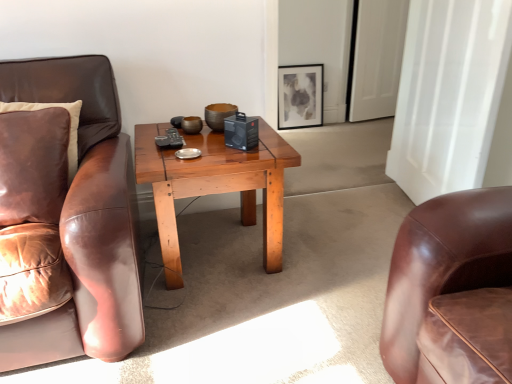
Where is `free spot in front of matte black picture frame at upper center`? The width and height of the screenshot is (512, 384). free spot in front of matte black picture frame at upper center is located at coordinates (308, 137).